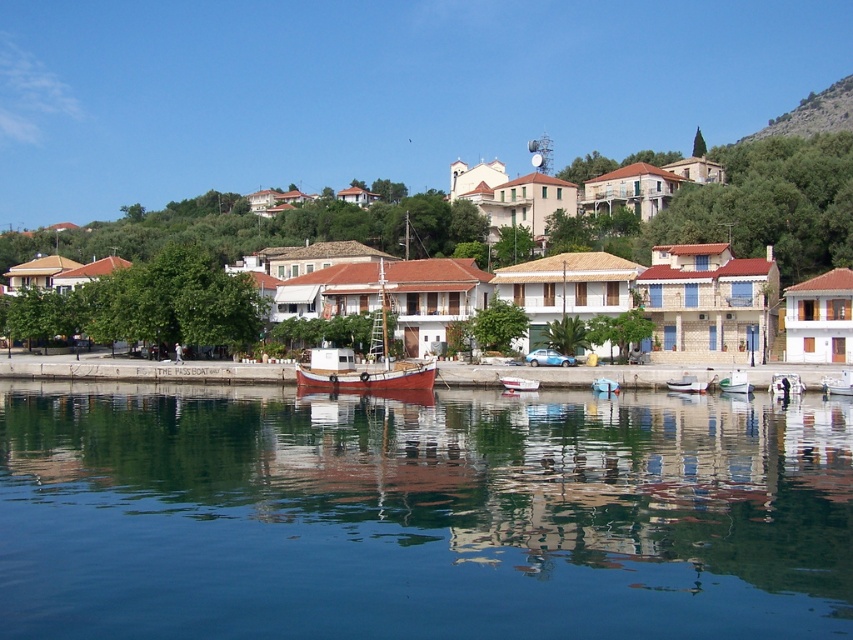
You are a tourist standing at the waterfront in the coastal village scene. You see the white plastic boat at center. Can you determine its exact position in the image using coordinates?

The white plastic boat at center is located at point coordinates of 0.598 along the x axis and 0.863 along the y axis.

You are standing at the point marked as point [735,381] in the coastal village scene. What object are you currently standing on?

You are standing on the white plastic boat at center.